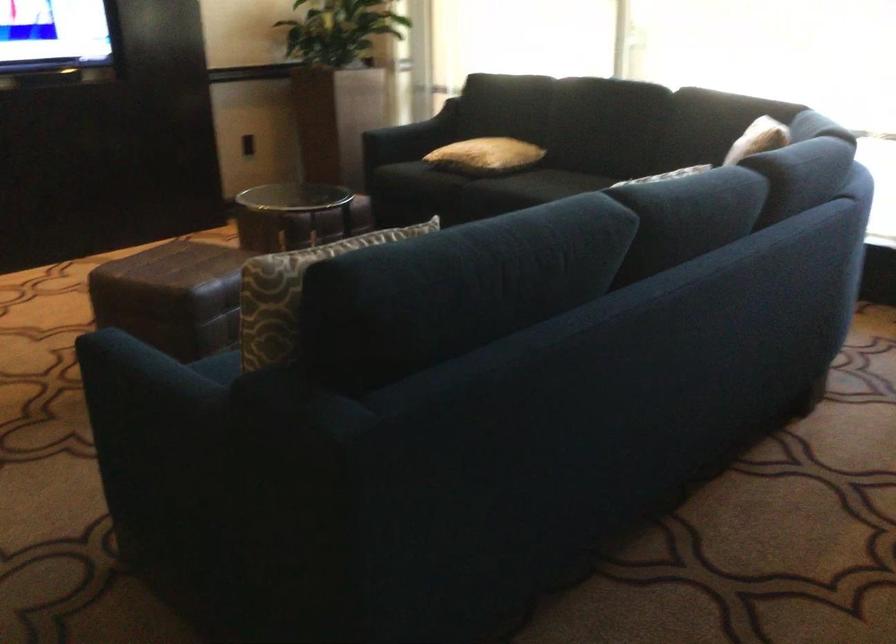
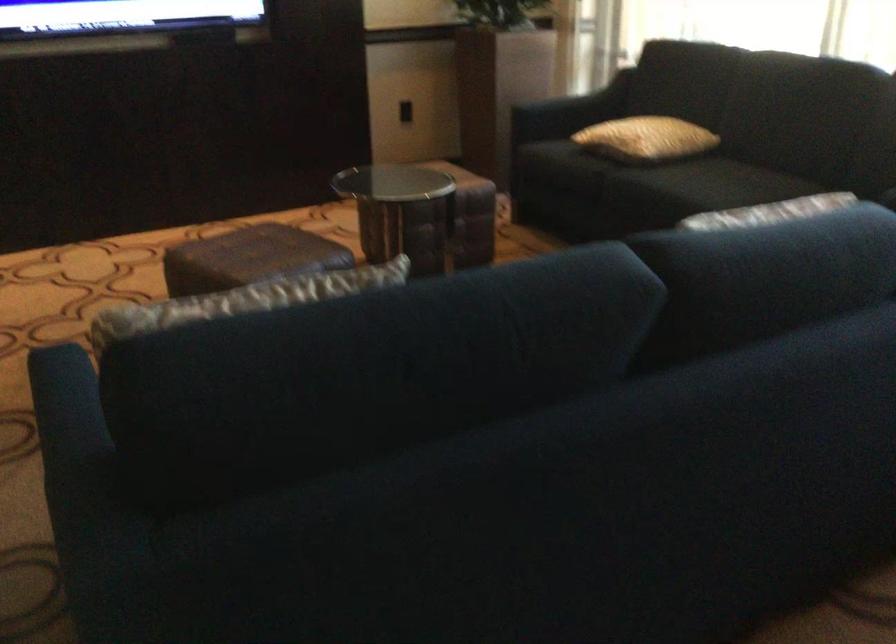
Question: The first image is from the beginning of the video and the second image is from the end. How did the camera likely rotate when shooting the video?

Choices:
 (A) Left
 (B) Right
 (C) Up
 (D) Down

Answer: (A)